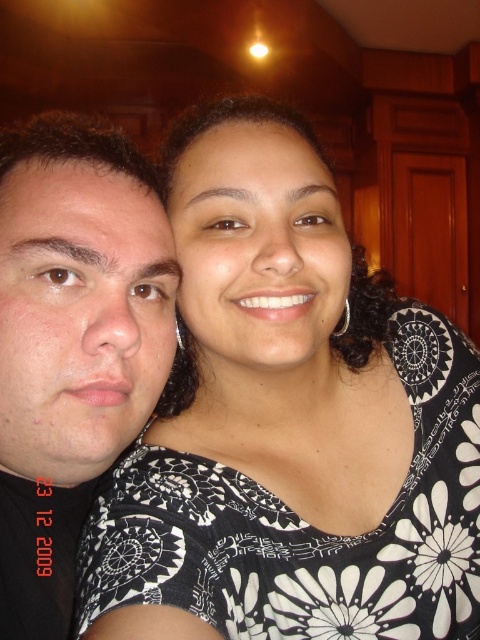
Question: Does black floral dress at center have a lesser width compared to matte black face at left?

Choices:
 (A) yes
 (B) no

Answer: (B)

Question: Does black floral dress at center have a greater width compared to matte black face at left?

Choices:
 (A) no
 (B) yes

Answer: (B)

Question: Can you confirm if black floral dress at center is wider than matte black face at left?

Choices:
 (A) yes
 (B) no

Answer: (A)